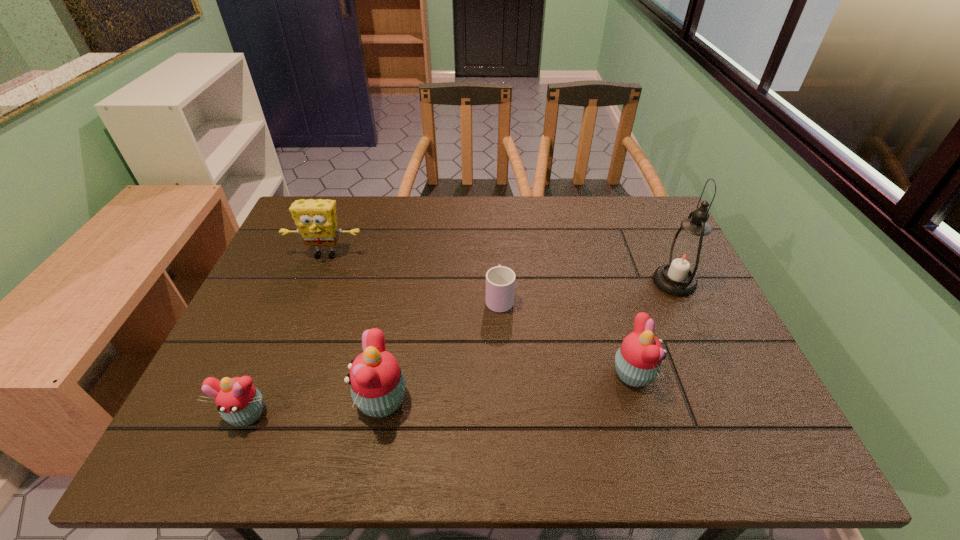
This screenshot has height=540, width=960. What are the coordinates of `free space located on the face of the fourth object from right to left` in the screenshot? It's located at (323, 400).

Where is `free region located 0.210m on the face of the fourth object from right to left`? The height and width of the screenshot is (540, 960). free region located 0.210m on the face of the fourth object from right to left is located at coordinates (257, 400).

The image size is (960, 540). I want to click on vacant region located on the face of the fourth object from right to left, so click(233, 400).

Identify the location of vacant space located 0.090m on the face of the second tallest cupcake. (695, 374).

At what (x,y) coordinates should I click in order to perform the action: click on free space located 0.220m on the back of the rightmost object. Please return your answer as a coordinate pair (x, y). This screenshot has height=540, width=960. Looking at the image, I should click on (645, 219).

Locate an element on the screen. vacant space located on the face of the sponge is located at coordinates (301, 317).

Find the location of a particular element. blank space located 0.200m with the handle on the side of the shortest object is located at coordinates (496, 238).

In order to click on vacant space located with the handle on the side of the shortest object in this screenshot , I will do `click(496, 232)`.

Find the location of a particular element. The image size is (960, 540). free spot located with the handle on the side of the shortest object is located at coordinates pyautogui.click(x=495, y=210).

Locate an element on the screen. cupcake that is at the left edge is located at coordinates click(x=238, y=401).